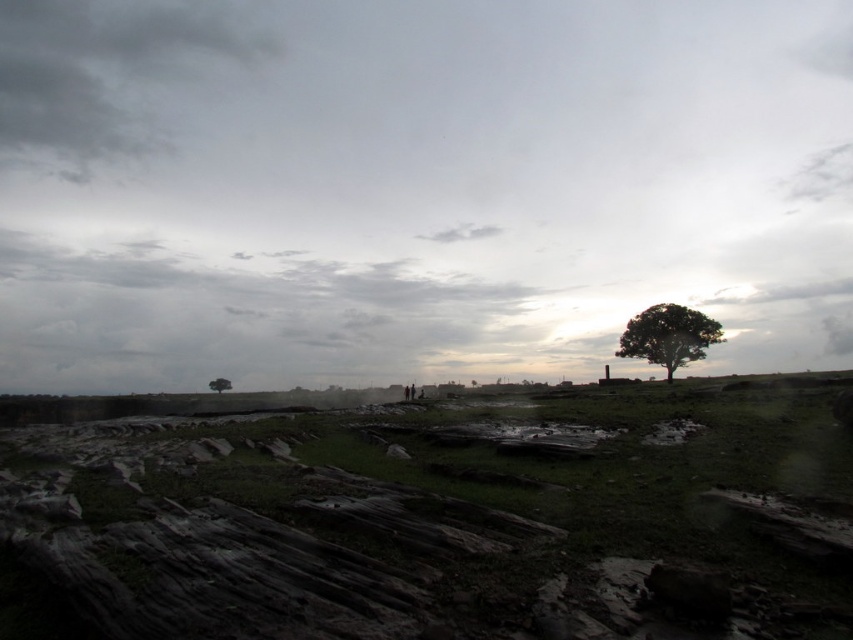
Which of these two, muddy stone at center or green matte tree at lower center, stands shorter?

green matte tree at lower center

Can you confirm if muddy stone at center is positioned above green matte tree at lower center?

Yes, muddy stone at center is above green matte tree at lower center.

Describe the element at coordinates (442, 518) in the screenshot. I see `muddy stone at center` at that location.

Where is `muddy stone at center`? muddy stone at center is located at coordinates (442, 518).

Is dark gray cloud at upper left thinner than green leafy tree at right?

No.

Measure the distance between dark gray cloud at upper left and camera.

dark gray cloud at upper left and camera are 185.11 meters apart.

Which is behind, point (50, 36) or point (695, 353)?

The point (50, 36) is more distant.

At what (x,y) coordinates should I click in order to perform the action: click on dark gray cloud at upper left. Please return your answer as a coordinate pair (x, y). Image resolution: width=853 pixels, height=640 pixels. Looking at the image, I should click on (106, 76).

Is green leafy tree at right bigger than green matte tree at lower center?

Incorrect, green leafy tree at right is not larger than green matte tree at lower center.

This screenshot has height=640, width=853. Describe the element at coordinates (668, 337) in the screenshot. I see `green leafy tree at right` at that location.

Find the location of a particular element. The height and width of the screenshot is (640, 853). green leafy tree at right is located at coordinates (668, 337).